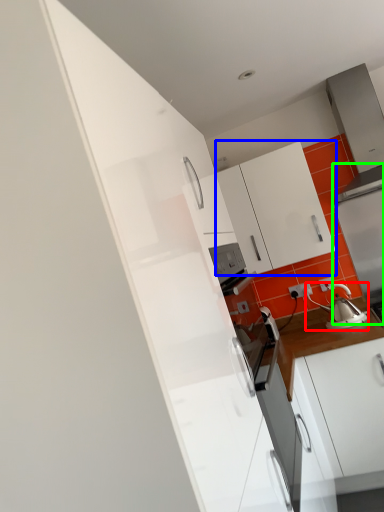
Question: Based on their relative distances, which object is farther from tea pot (highlighted by a red box)? Choose from cabinetry (highlighted by a blue box) and appliance (highlighted by a green box).

Choices:
 (A) cabinetry
 (B) appliance

Answer: (A)